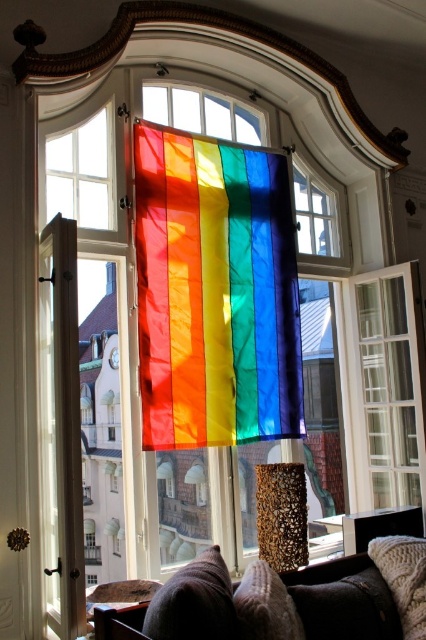
You are an interior designer assessing the space. You need to determine if the rainbow fabric flag at center can be replaced with a larger decorative item without removing the brown textured pillow at lower center. Based on their sizes, is this possible?

The rainbow fabric flag at center is larger in size than brown textured pillow at lower center. Since the flag is already larger, replacing it with an even larger decorative item would require more space, so it may not be possible without adjusting the current arrangement or removing the pillow.

You are standing in a room and want to reach out and touch the rainbow fabric flag at center. If your arm can extend 1.5 meters, will you be able to reach it?

The rainbow fabric flag at center is 3.08 meters away from the viewer. Since your arm can only extend 1.5 meters, you cannot reach it.

You are a guest in a living room and want to sit on the velvet brown couch at lower center. There is a knitted white pillow at lower right nearby. Can you place the pillow on the couch?

The velvet brown couch at lower center might be wider than knitted white pillow at lower right, so it is possible that the pillow can fit on the couch.